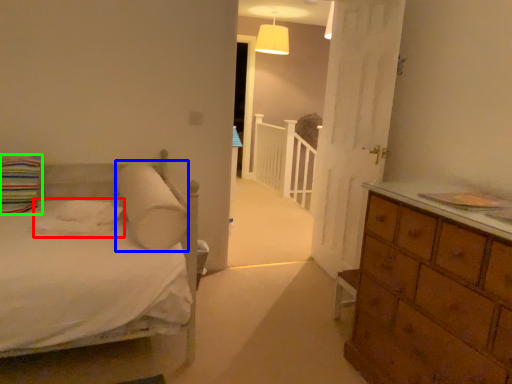
Question: Which object is positioned farthest from sheet (highlighted by a red box)? Select from pillow (highlighted by a blue box) and pillow (highlighted by a green box).

Choices:
 (A) pillow
 (B) pillow

Answer: (B)